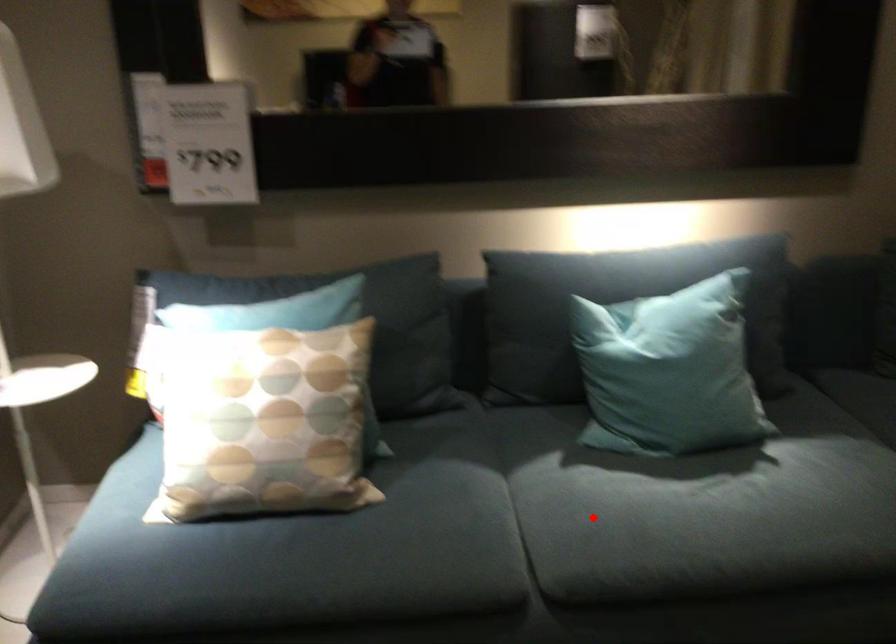
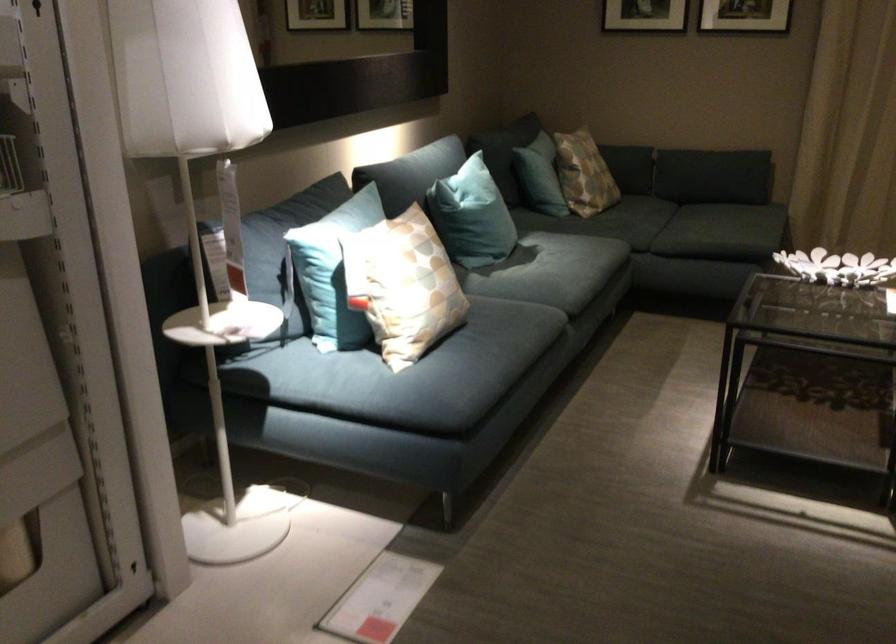
In the second image, find the point that corresponds to the highlighted location in the first image.

(552, 275)